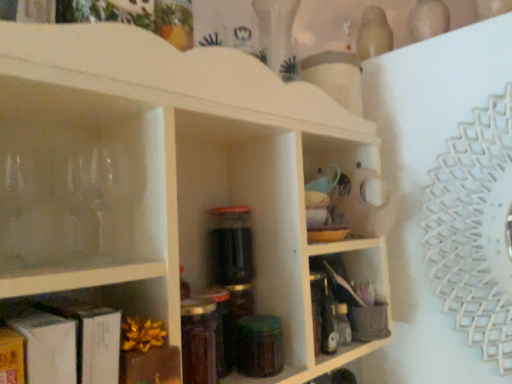
Question: Is point (380, 281) positioned closer to the camera than point (25, 115)?

Choices:
 (A) farther
 (B) closer

Answer: (A)

Question: Is matte plastic container at lower right, which is the 3th shelf from front to back, taller or shorter than white matte shelf at center, which is the second shelf from back to front?

Choices:
 (A) tall
 (B) short

Answer: (B)

Question: Based on their relative distances, which object is farther from the white matte shelf at center, placed as the second shelf when sorted from front to back?

Choices:
 (A) matte plastic container at lower right, which is the 3th shelf from front to back
 (B) green glass jar at center
 (C) matte brown book at lower left, the third shelf viewed from the back
 (D) translucent plastic bottle at center-right, the first bottle viewed from the back
 (E) translucent glass jar at center, marked as the first bottle in a front-to-back arrangement

Answer: (D)

Question: Considering the real-world distances, which object is closest to the green glass jar at center?

Choices:
 (A) translucent glass jar at center, marked as the second bottle in a back-to-front arrangement
 (B) white matte shelf at center, which is the second shelf from back to front
 (C) matte brown book at lower left, the third shelf viewed from the back
 (D) translucent plastic bottle at center-right, positioned as the 2th bottle in left-to-right order
 (E) matte plastic container at lower right, which is the 3th shelf from front to back

Answer: (A)